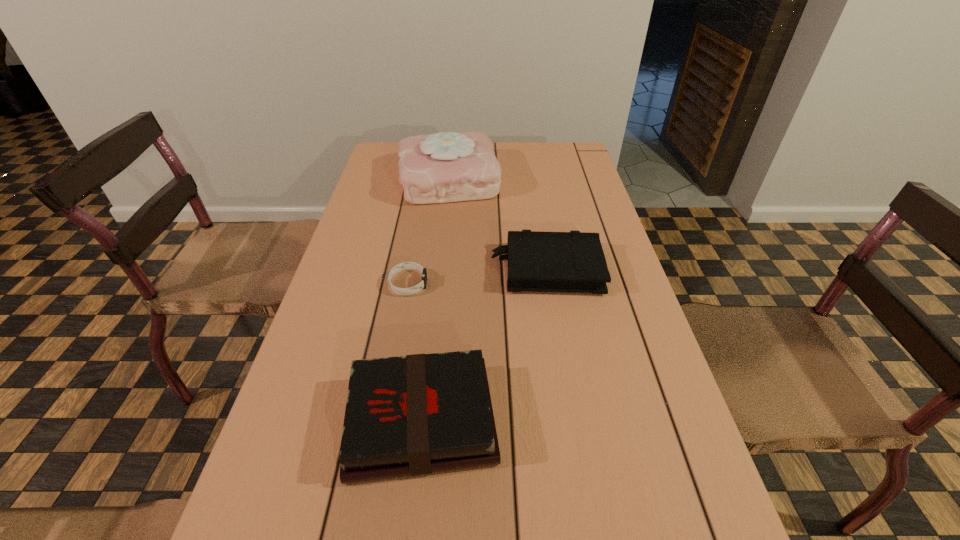
I want to click on vacant point that satisfies the following two spatial constraints: 1. on the outer surface of the hardback book; 2. on the left side of the shortest object, so click(x=384, y=421).

Image resolution: width=960 pixels, height=540 pixels. What are the coordinates of `free space in the image that satisfies the following two spatial constraints: 1. on the outer surface of the shortest object; 2. on the back side of the nearest object` in the screenshot? It's located at (384, 421).